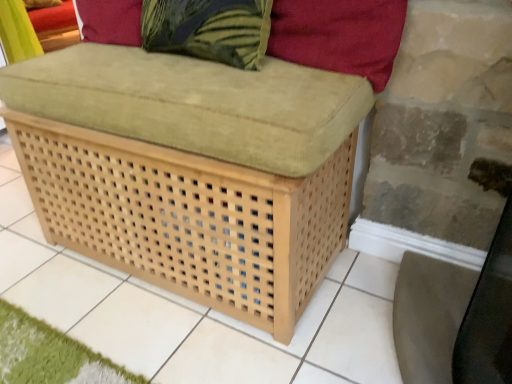
This screenshot has height=384, width=512. What do you see at coordinates (456, 316) in the screenshot?
I see `matte beige swivel chair at lower right` at bounding box center [456, 316].

Locate an element on the screen. matte beige swivel chair at lower right is located at coordinates point(456,316).

Describe the element at coordinates (204, 152) in the screenshot. The height and width of the screenshot is (384, 512). I see `light brown woven ottoman at center` at that location.

Identify the location of light brown woven ottoman at center. (204, 152).

The image size is (512, 384). What are the coordinates of `green textured pillow at upper center` in the screenshot? It's located at (209, 29).

Are green textured pillow at upper center and matte beige swivel chair at lower right beside each other?

No, green textured pillow at upper center is not with matte beige swivel chair at lower right.

Do you think green textured pillow at upper center is within matte beige swivel chair at lower right, or outside of it?

green textured pillow at upper center is not inside matte beige swivel chair at lower right, it's outside.

From the image's perspective, does green textured pillow at upper center appear lower than matte beige swivel chair at lower right?

No, from the image's perspective, green textured pillow at upper center is not beneath matte beige swivel chair at lower right.

Which object is closer to the camera, green textured pillow at upper center or matte beige swivel chair at lower right?

matte beige swivel chair at lower right is more forward.

Considering the points (489, 319) and (264, 232), which point is behind, point (489, 319) or point (264, 232)?

Positioned behind is point (264, 232).

How many degrees apart are the facing directions of matte beige swivel chair at lower right and light brown woven ottoman at center?

46 degrees.

Does matte beige swivel chair at lower right touch light brown woven ottoman at center?

There is a gap between matte beige swivel chair at lower right and light brown woven ottoman at center.

Between matte beige swivel chair at lower right and light brown woven ottoman at center, which one has more height?

With more height is matte beige swivel chair at lower right.

Does velvet red pillow at upper right lie behind light brown woven ottoman at center?

Yes, the depth of velvet red pillow at upper right is greater than that of light brown woven ottoman at center.

What's the angular difference between velvet red pillow at upper right and light brown woven ottoman at center's facing directions?

They differ by 4.67 degrees in their facing directions.

Is velvet red pillow at upper right next to light brown woven ottoman at center?

No, velvet red pillow at upper right is not with light brown woven ottoman at center.

Could you tell me if velvet red pillow at upper right is turned towards light brown woven ottoman at center?

No.

Considering the positions of objects light brown woven ottoman at center and matte beige swivel chair at lower right in the image provided, who is more to the right, light brown woven ottoman at center or matte beige swivel chair at lower right?

From the viewer's perspective, matte beige swivel chair at lower right appears more on the right side.

Considering the sizes of objects light brown woven ottoman at center and matte beige swivel chair at lower right in the image provided, who is wider, light brown woven ottoman at center or matte beige swivel chair at lower right?

Wider between the two is light brown woven ottoman at center.

Is light brown woven ottoman at center oriented towards matte beige swivel chair at lower right?

No.

Looking at this image, from a real-world perspective, who is located lower, light brown woven ottoman at center or matte beige swivel chair at lower right?

light brown woven ottoman at center, from a real-world perspective.

Considering the sizes of objects light brown woven ottoman at center and velvet red pillow at upper right in the image provided, who is smaller, light brown woven ottoman at center or velvet red pillow at upper right?

velvet red pillow at upper right.

You are a GUI agent. You are given a task and a screenshot of the screen. Output one action in this format:
    pyautogui.click(x=<x>, y=<y>)
    Task: Click on the furniture below the velvet red pillow at upper right (from a real-world perspective)
    The image size is (512, 384).
    Given the screenshot: What is the action you would take?
    pyautogui.click(x=204, y=152)

Is light brown woven ottoman at center further to the viewer compared to velvet red pillow at upper right?

No.

Can you confirm if light brown woven ottoman at center is shorter than velvet red pillow at upper right?

In fact, light brown woven ottoman at center may be taller than velvet red pillow at upper right.

Is green textured pillow at upper center wider or thinner than velvet red pillow at upper right?

Considering their sizes, green textured pillow at upper center looks broader than velvet red pillow at upper right.

Is green textured pillow at upper center positioned with its back to velvet red pillow at upper right?

green textured pillow at upper center does not have its back to velvet red pillow at upper right.

Which point is more forward, (269, 27) or (290, 45)?

Point (269, 27)

Can you tell me how much green textured pillow at upper center and velvet red pillow at upper right differ in facing direction?

There is a 4.67-degree angle between the facing directions of green textured pillow at upper center and velvet red pillow at upper right.

Which is more to the right, green textured pillow at upper center or light brown woven ottoman at center?

Positioned to the right is green textured pillow at upper center.

From the image's perspective, which is above, green textured pillow at upper center or light brown woven ottoman at center?

From the image's view, green textured pillow at upper center is above.

From a real-world perspective, is green textured pillow at upper center physically located above or below light brown woven ottoman at center?

From a real-world perspective, green textured pillow at upper center is physically above light brown woven ottoman at center.

Locate an element on the screen. This screenshot has height=384, width=512. throw pillow that appears above the light brown woven ottoman at center (from the image's perspective) is located at coordinates (209, 29).

This screenshot has height=384, width=512. What are the coordinates of `swivel chair beneath the green textured pillow at upper center (from a real-world perspective)` in the screenshot? It's located at (456, 316).

Identify the location of furniture above the matte beige swivel chair at lower right (from the image's perspective). This screenshot has height=384, width=512. (204, 152).

Which object lies nearer to the anchor point matte beige swivel chair at lower right, velvet red pillow at upper right or light brown woven ottoman at center?

velvet red pillow at upper right lies closer to matte beige swivel chair at lower right than the other object.

When comparing their distances from light brown woven ottoman at center, does velvet red pillow at upper right or matte beige swivel chair at lower right seem closer?

Based on the image, velvet red pillow at upper right appears to be nearer to light brown woven ottoman at center.

When comparing their distances from matte beige swivel chair at lower right, does velvet red pillow at upper right or green textured pillow at upper center seem further?

Based on the image, green textured pillow at upper center appears to be further to matte beige swivel chair at lower right.

Based on their spatial positions, is light brown woven ottoman at center or matte beige swivel chair at lower right closer to green textured pillow at upper center?

The object closer to green textured pillow at upper center is light brown woven ottoman at center.

From the image, which object appears to be farther from green textured pillow at upper center, matte beige swivel chair at lower right or velvet red pillow at upper right?

Based on the image, matte beige swivel chair at lower right appears to be further to green textured pillow at upper center.

Based on their spatial positions, is velvet red pillow at upper right or matte beige swivel chair at lower right further from green textured pillow at upper center?

Among the two, matte beige swivel chair at lower right is located further to green textured pillow at upper center.

When comparing their distances from matte beige swivel chair at lower right, does light brown woven ottoman at center or velvet red pillow at upper right seem closer?

velvet red pillow at upper right is closer to matte beige swivel chair at lower right.

Which object lies further to the anchor point matte beige swivel chair at lower right, green textured pillow at upper center or velvet red pillow at upper right?

green textured pillow at upper center is positioned further to the anchor matte beige swivel chair at lower right.

Identify the location of pillow between light brown woven ottoman at center and matte beige swivel chair at lower right. The height and width of the screenshot is (384, 512). (339, 35).

Find the location of a particular element. throw pillow between light brown woven ottoman at center and velvet red pillow at upper right is located at coordinates (209, 29).

The width and height of the screenshot is (512, 384). In order to click on pillow that lies between green textured pillow at upper center and matte beige swivel chair at lower right from top to bottom in this screenshot , I will do `click(339, 35)`.

Where is `throw pillow between light brown woven ottoman at center and matte beige swivel chair at lower right in the horizontal direction`? The width and height of the screenshot is (512, 384). throw pillow between light brown woven ottoman at center and matte beige swivel chair at lower right in the horizontal direction is located at coordinates (209, 29).